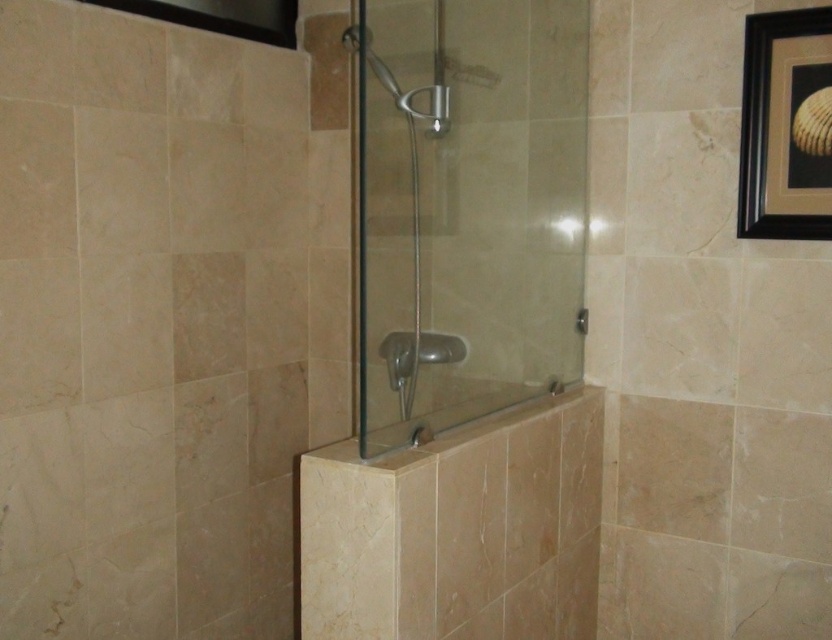
In the scene shown: Who is positioned more to the left, transparent glass shower door at center or beige marble bath at center?

Positioned to the left is transparent glass shower door at center.

Where is `transparent glass shower door at center`? This screenshot has width=832, height=640. transparent glass shower door at center is located at coordinates (468, 209).

The image size is (832, 640). What do you see at coordinates (468, 209) in the screenshot?
I see `transparent glass shower door at center` at bounding box center [468, 209].

Image resolution: width=832 pixels, height=640 pixels. In order to click on transparent glass shower door at center in this screenshot , I will do `click(468, 209)`.

Can you confirm if transparent glass shower door at center is wider than black matte picture frame at upper right?

Yes, transparent glass shower door at center is wider than black matte picture frame at upper right.

Consider the image. Between transparent glass shower door at center and black matte picture frame at upper right, which one appears on the right side from the viewer's perspective?

From the viewer's perspective, black matte picture frame at upper right appears more on the right side.

Is point (369, 228) more distant than point (810, 131)?

Yes, point (369, 228) is farther from viewer.

This screenshot has height=640, width=832. Identify the location of transparent glass shower door at center. (468, 209).

Is transparent glass shower door at center taller than clear glass shower head at center?

Yes.

Is transparent glass shower door at center to the left of clear glass shower head at center from the viewer's perspective?

Indeed, transparent glass shower door at center is positioned on the left side of clear glass shower head at center.

Describe the element at coordinates (468, 209) in the screenshot. I see `transparent glass shower door at center` at that location.

The image size is (832, 640). In order to click on transparent glass shower door at center in this screenshot , I will do `click(468, 209)`.